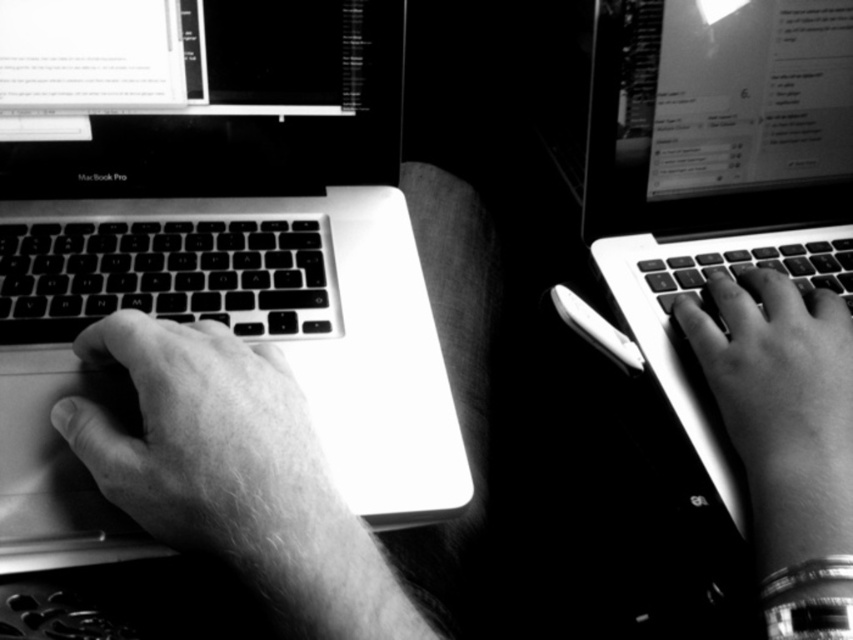
Question: Is the position of smooth skin hand at center more distant than that of smooth skin hand at right?

Choices:
 (A) no
 (B) yes

Answer: (A)

Question: Estimate the real-world distances between objects in this image. Which object is closer to the metallic keyboard at right?

Choices:
 (A) metallic keyboard at center
 (B) smooth skin hand at right
 (C) smooth skin hand at center

Answer: (B)

Question: Which object is the farthest from the smooth skin hand at left?

Choices:
 (A) smooth skin hand at right
 (B) smooth skin hand at center
 (C) black matte keyboard at left
 (D) metallic keyboard at center

Answer: (A)

Question: Estimate the real-world distances between objects in this image. Which object is farther from the metallic keyboard at right?

Choices:
 (A) black matte keyboard at left
 (B) smooth skin hand at center
 (C) smooth skin hand at right
 (D) smooth skin hand at left

Answer: (D)

Question: Considering the relative positions of smooth skin hand at center and metallic keyboard at right in the image provided, where is smooth skin hand at center located with respect to metallic keyboard at right?

Choices:
 (A) right
 (B) left

Answer: (B)

Question: Is the position of smooth skin hand at left more distant than that of black matte keyboard at left?

Choices:
 (A) no
 (B) yes

Answer: (A)